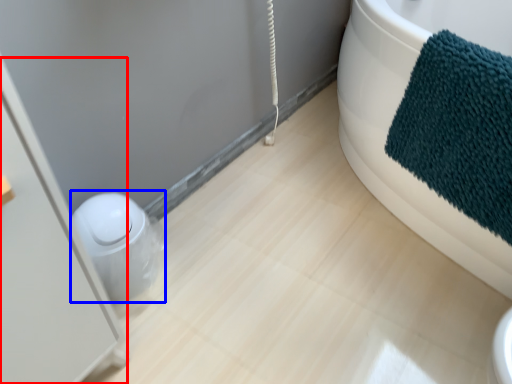
Question: Which of the following is the farthest to the observer, screen door (highlighted by a red box) or toilet bowl (highlighted by a blue box)?

Choices:
 (A) screen door
 (B) toilet bowl

Answer: (B)